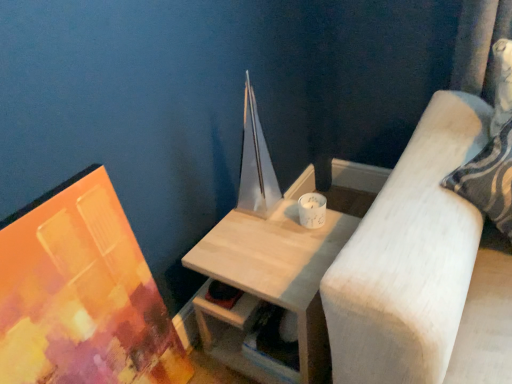
The image size is (512, 384). I want to click on vacant area in front of white ceramic candle at upper right, so click(305, 252).